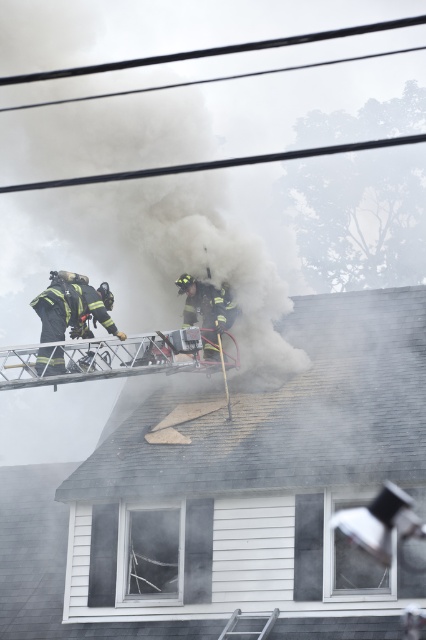
Which is more to the left, white fluffy smoke at center or gray shingles at upper center?

Positioned to the left is white fluffy smoke at center.

How much distance is there between white fluffy smoke at center and gray shingles at upper center?

A distance of 53.93 feet exists between white fluffy smoke at center and gray shingles at upper center.

I want to click on white fluffy smoke at center, so click(150, 244).

In order to click on white fluffy smoke at center in this screenshot , I will do `click(150, 244)`.

Is gray shingles at upper center further to camera compared to silver metallic ladder at lower center?

Yes, it is.

Between gray shingles at upper center and silver metallic ladder at lower center, which one appears on the right side from the viewer's perspective?

silver metallic ladder at lower center is more to the right.

Where is `gray shingles at upper center`? gray shingles at upper center is located at coordinates (290, 413).

Is point (39, 160) positioned before point (54, 348)?

No.

Is white fluffy smoke at center below black matte fireman at upper left?

No, white fluffy smoke at center is not below black matte fireman at upper left.

Image resolution: width=426 pixels, height=640 pixels. What are the coordinates of `white fluffy smoke at center` in the screenshot? It's located at coord(150,244).